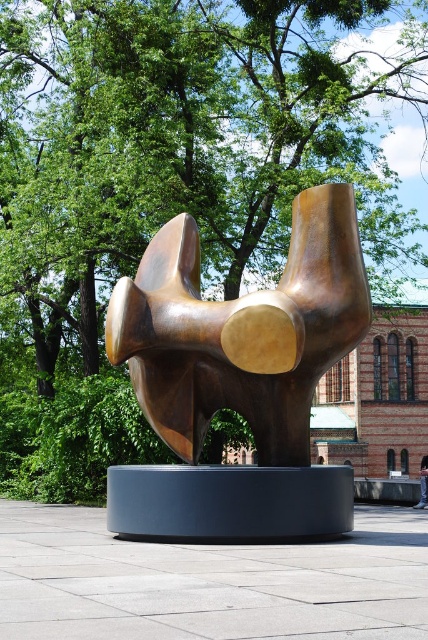
Question: Which point is closer to the camera?

Choices:
 (A) bronze sculpture at center
 (B) denim pants at lower right

Answer: (A)

Question: Does bronze sculpture at center appear under denim pants at lower right?

Choices:
 (A) yes
 (B) no

Answer: (B)

Question: Does bronze sculpture at center have a larger size compared to denim pants at lower right?

Choices:
 (A) yes
 (B) no

Answer: (B)

Question: Is bronze sculpture at center above denim pants at lower right?

Choices:
 (A) no
 (B) yes

Answer: (B)

Question: Which point is farther from the camera taking this photo?

Choices:
 (A) (348, 221)
 (B) (424, 502)

Answer: (B)